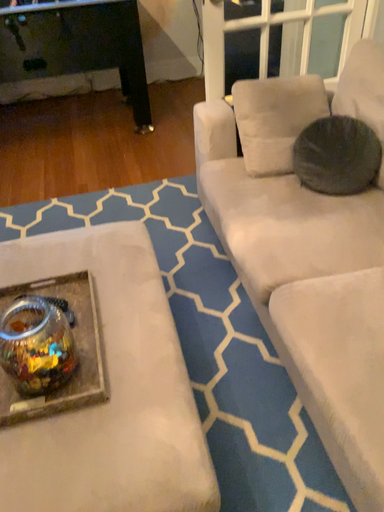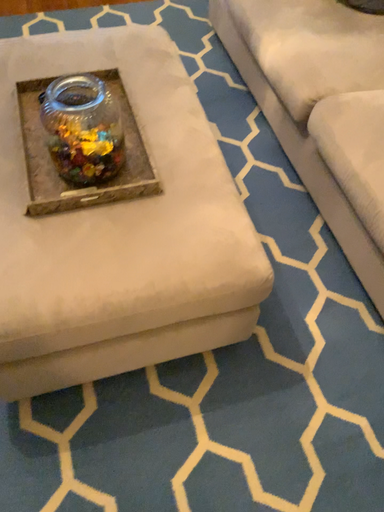
Question: How did the camera likely rotate when shooting the video?

Choices:
 (A) rotated downward
 (B) rotated upward

Answer: (A)